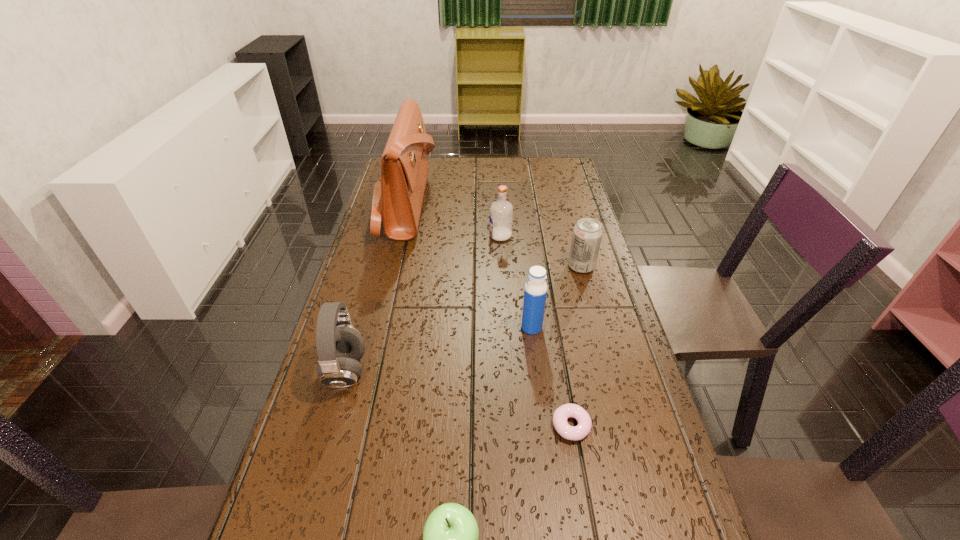
Select which object is the third closest to the shortest object. Please provide its 2D coordinates. Your answer should be formatted as a tuple, i.e. [(x, y)], where the tuple contains the x and y coordinates of a point satisfying the conditions above.

[(340, 346)]

What are the coordinates of `object identified as the second closest to the shortest object` in the screenshot? It's located at (535, 291).

I want to click on vacant space that satisfies the following two spatial constraints: 1. on the back side of the water bottle; 2. on the label of the fourth object from left to right, so click(521, 236).

You are a GUI agent. You are given a task and a screenshot of the screen. Output one action in this format:
    pyautogui.click(x=<x>, y=<y>)
    Task: Click on the free location that satisfies the following two spatial constraints: 1. on the label of the fourth object from right to left; 2. on the right side of the water bottle
    Image resolution: width=960 pixels, height=540 pixels.
    Given the screenshot: What is the action you would take?
    pyautogui.click(x=506, y=327)

The height and width of the screenshot is (540, 960). In order to click on free spot that satisfies the following two spatial constraints: 1. on the ear cups of the third nearest object; 2. on the left side of the shortest object in this screenshot , I will do `click(330, 426)`.

I want to click on free space that satisfies the following two spatial constraints: 1. on the back side of the fourth farthest object; 2. on the right side of the rightmost object, so click(x=524, y=266).